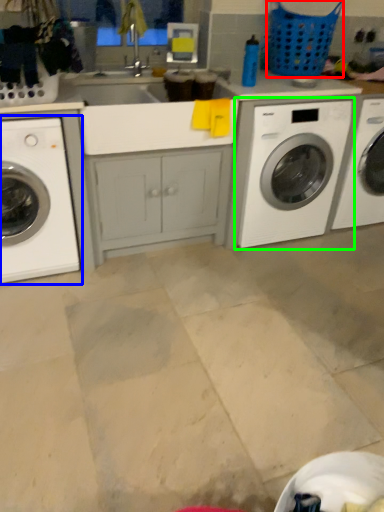
Question: Which object is positioned farthest from basket (highlighted by a red box)? Select from washing machine (highlighted by a blue box) and washing machine (highlighted by a green box).

Choices:
 (A) washing machine
 (B) washing machine

Answer: (A)